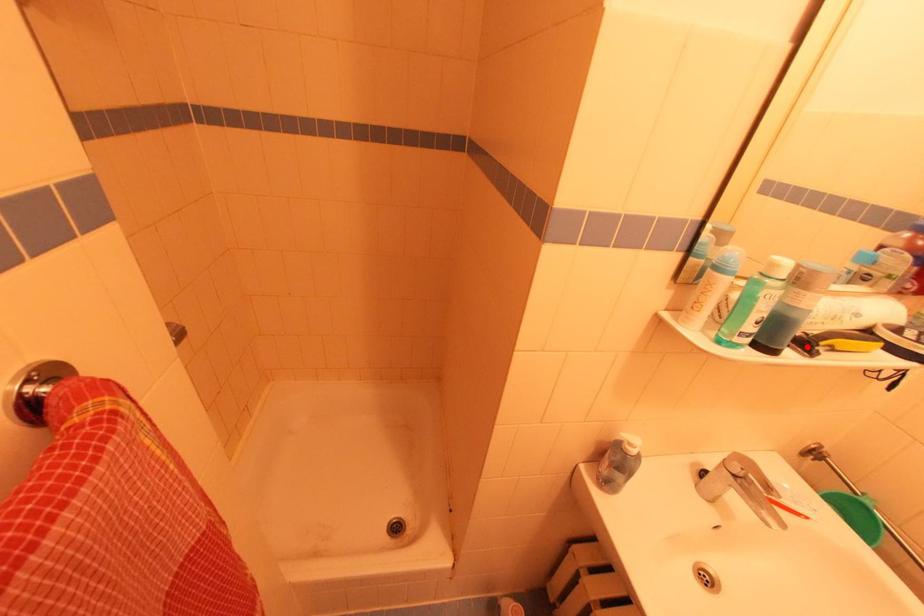
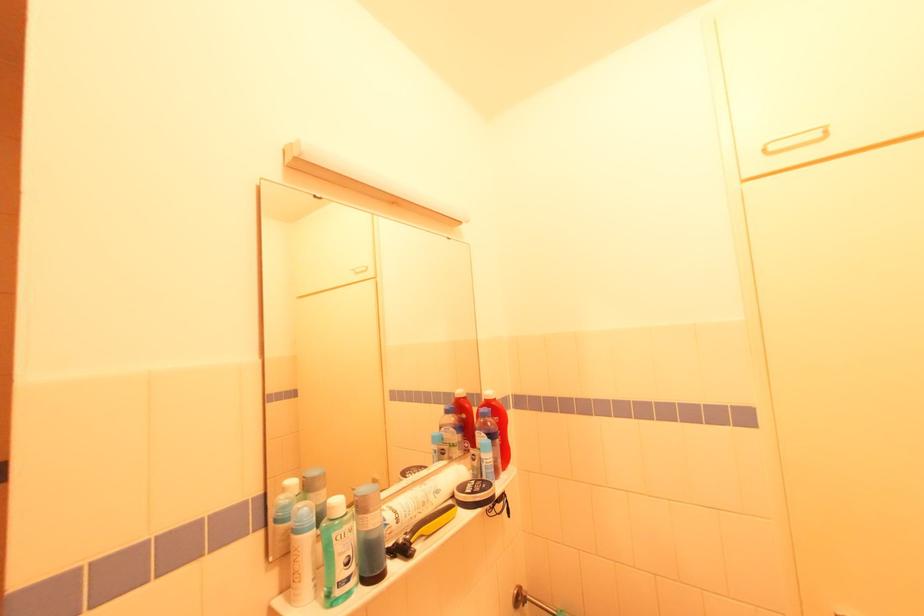
In the second image, find the point that corresponds to the highlighted location in the first image.

(406, 552)